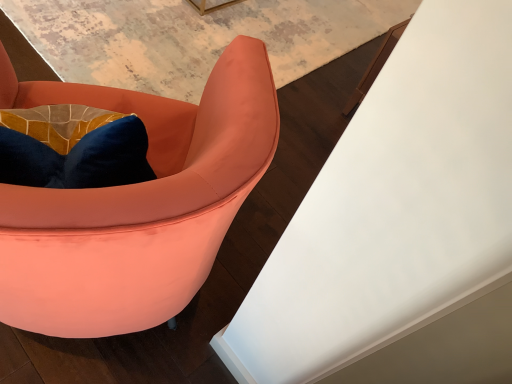
Question: Considering their positions, is white glossy table at upper right located in front of or behind satin peach armchair at left?

Choices:
 (A) front
 (B) behind

Answer: (B)

Question: From the image's perspective, is white glossy table at upper right located above or below satin peach armchair at left?

Choices:
 (A) above
 (B) below

Answer: (A)

Question: Is white glossy table at upper right wider or thinner than satin peach armchair at left?

Choices:
 (A) thin
 (B) wide

Answer: (B)

Question: From the image's perspective, relative to white glossy table at upper right, is satin peach armchair at left above or below?

Choices:
 (A) above
 (B) below

Answer: (B)

Question: Is satin peach armchair at left taller or shorter than white glossy table at upper right?

Choices:
 (A) tall
 (B) short

Answer: (A)

Question: From a real-world perspective, relative to white glossy table at upper right, is satin peach armchair at left vertically above or below?

Choices:
 (A) above
 (B) below

Answer: (A)

Question: Does point (131, 92) appear closer or farther from the camera than point (440, 241)?

Choices:
 (A) farther
 (B) closer

Answer: (A)